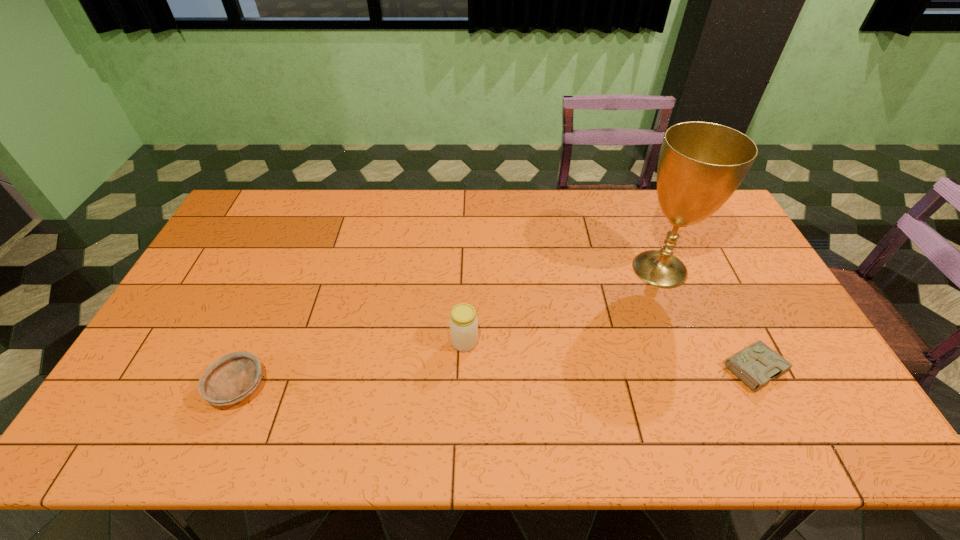
Where is `vacant area between the shortest object and the farthest object`? The width and height of the screenshot is (960, 540). vacant area between the shortest object and the farthest object is located at coordinates (705, 319).

At what (x,y) coordinates should I click in order to perform the action: click on vacant space that is in between the shortest object and the jar. Please return your answer as a coordinate pair (x, y). The image size is (960, 540). Looking at the image, I should click on (608, 355).

Identify the location of vacant area between the bowl and the tallest object. The image size is (960, 540). (449, 328).

This screenshot has width=960, height=540. I want to click on vacant region between the farthest object and the second object from left to right, so click(563, 306).

Locate an element on the screen. free spot between the trophy cup and the diary is located at coordinates (705, 319).

Where is `vacant area that lies between the shortest object and the third shortest object`? This screenshot has height=540, width=960. vacant area that lies between the shortest object and the third shortest object is located at coordinates (608, 355).

I want to click on free space between the farthest object and the diary, so click(x=705, y=319).

At what (x,y) coordinates should I click in order to perform the action: click on object that is the third closest to the second tallest object. Please return your answer as a coordinate pair (x, y). Looking at the image, I should click on (757, 364).

In order to click on object that is the third nearest to the farthest object in this screenshot , I will do `click(232, 378)`.

Find the location of a particular element. Image resolution: width=960 pixels, height=540 pixels. vacant space that satisfies the following two spatial constraints: 1. on the back side of the diary; 2. on the left side of the second shortest object is located at coordinates (247, 369).